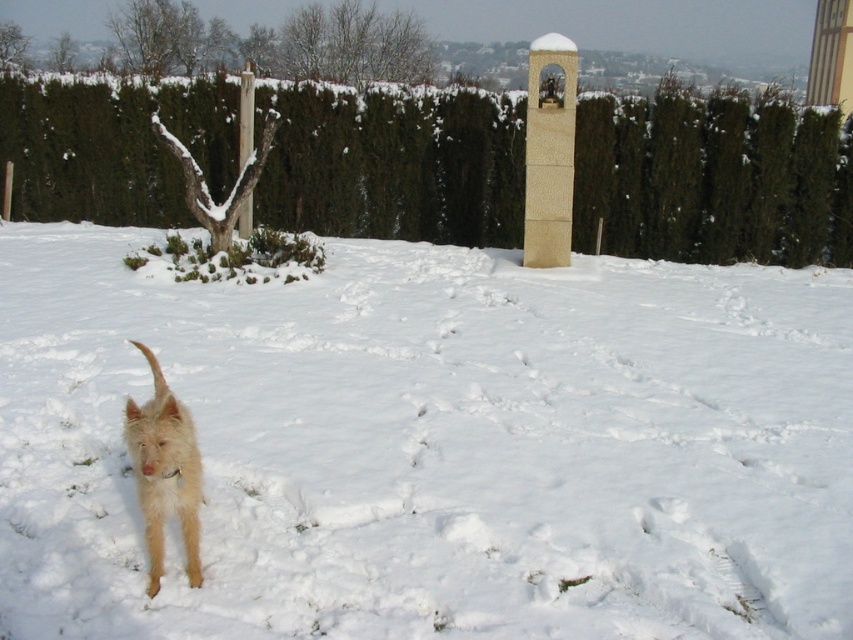
You are a small dog with light colored fur. You see the white fluffy snow at center and the green hedge at upper center. Which one is closer to you?

The white fluffy snow at center is closer to you because it is in front of the green hedge at upper center.

You are a small dog with light colored fur standing on the white fluffy snow at center. You want to reach the green hedge at upper center. Which direction should you move in?

The white fluffy snow at center is located below the green hedge at upper center, so the dog should move upward to reach the green hedge at upper center.